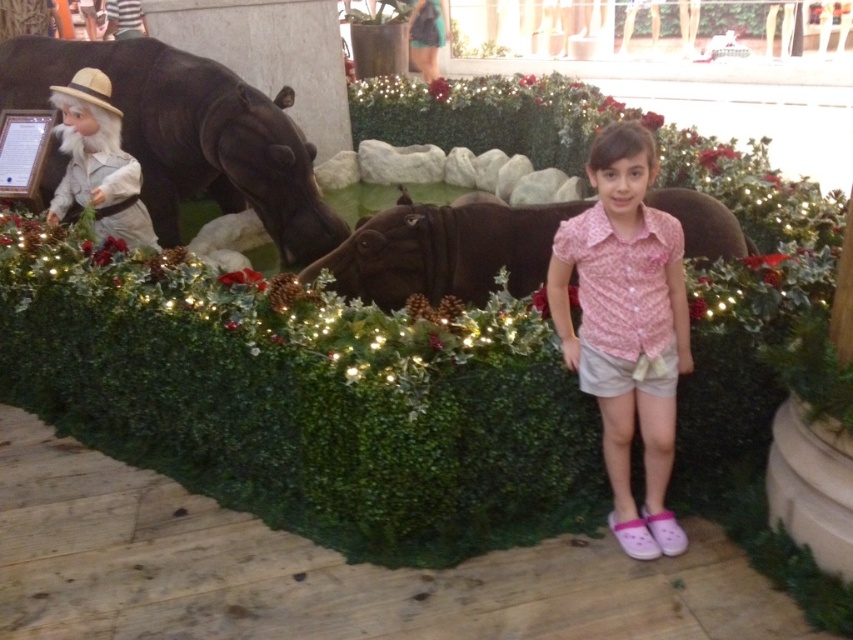
Who is taller, brown matte hippo at center or white matte statue at left?

Standing taller between the two is white matte statue at left.

Does brown matte hippo at center lie in front of white matte statue at left?

That is True.

The image size is (853, 640). I want to click on brown matte hippo at center, so click(x=444, y=252).

Does shiny black hippo at left appear on the left side of brown matte hippo at center?

Indeed, shiny black hippo at left is positioned on the left side of brown matte hippo at center.

Can you confirm if shiny black hippo at left is wider than brown matte hippo at center?

Yes.

Find the location of a particular element. The image size is (853, 640). shiny black hippo at left is located at coordinates (190, 134).

Where is `shiny black hippo at left`? This screenshot has height=640, width=853. shiny black hippo at left is located at coordinates (190, 134).

Between point (612, 460) and point (206, 109), which one is positioned in front?

Point (612, 460)

Image resolution: width=853 pixels, height=640 pixels. What are the coordinates of `pink floral shirt at center` in the screenshot? It's located at (625, 326).

Which is behind, point (662, 440) or point (305, 216)?

The point (305, 216) is behind.

Find the location of `pink floral shirt at center`. pink floral shirt at center is located at coordinates (625, 326).